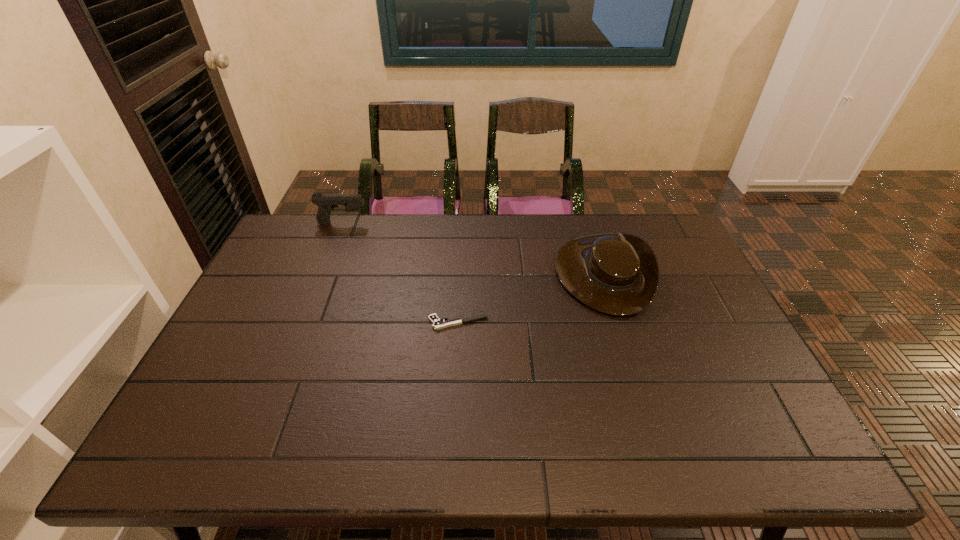
Select which object is the second closest to the shorter pistol. Please provide its 2D coordinates. Your answer should be formatted as a tuple, i.e. [(x, y)], where the tuple contains the x and y coordinates of a point satisfying the conditions above.

[(326, 203)]

Find the location of a particular element. This screenshot has height=540, width=960. object that is the closest to the taller pistol is located at coordinates (437, 323).

Where is `free space in the image that satisfies the following two spatial constraints: 1. on the back side of the rightmost object; 2. at the barrel of the tallest object`? free space in the image that satisfies the following two spatial constraints: 1. on the back side of the rightmost object; 2. at the barrel of the tallest object is located at coordinates (586, 223).

This screenshot has height=540, width=960. Find the location of `vacant space that satisfies the following two spatial constraints: 1. on the back side of the cowboy hat; 2. at the barrel of the left pistol`. vacant space that satisfies the following two spatial constraints: 1. on the back side of the cowboy hat; 2. at the barrel of the left pistol is located at coordinates (586, 223).

I want to click on vacant region that satisfies the following two spatial constraints: 1. on the back side of the rightmost object; 2. at the barrel of the left pistol, so click(x=586, y=223).

At what (x,y) coordinates should I click in order to perform the action: click on vacant space that satisfies the following two spatial constraints: 1. at the barrel of the left pistol; 2. on the right side of the rightmost object. Please return your answer as a coordinate pair (x, y). Looking at the image, I should click on (323, 273).

Identify the location of vacant position in the image that satisfies the following two spatial constraints: 1. at the barrel of the farther pistol; 2. on the left side of the rightmost object. (323, 273).

Find the location of a particular element. The image size is (960, 540). free space that satisfies the following two spatial constraints: 1. at the barrel of the cowboy hat; 2. on the left side of the left pistol is located at coordinates (323, 273).